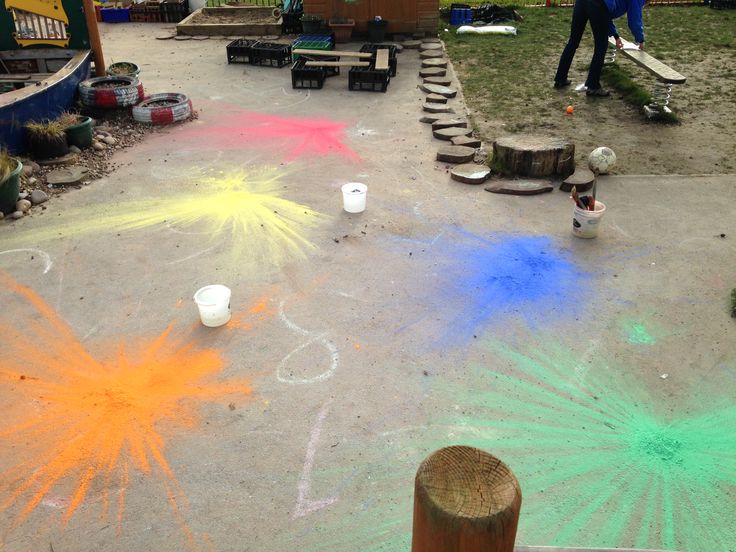
Where is `board`? Image resolution: width=736 pixels, height=552 pixels. board is located at coordinates (657, 68).